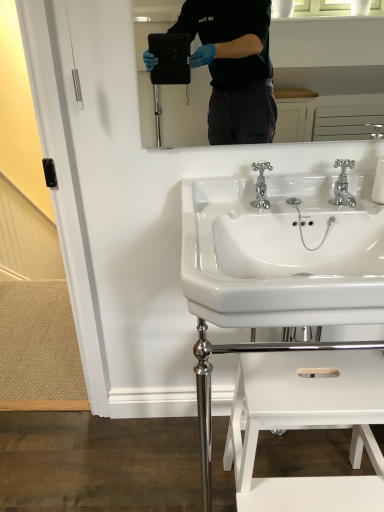
Question: From a real-world perspective, is white glossy step stool at lower center physically below white glossy sink at center, acting as the 2th sink starting from the bottom?

Choices:
 (A) yes
 (B) no

Answer: (A)

Question: Is white glossy step stool at lower center facing away from white glossy sink at center, acting as the 2th sink starting from the bottom?

Choices:
 (A) yes
 (B) no

Answer: (B)

Question: Is white glossy step stool at lower center taller than white glossy sink at center, arranged as the 1th sink when viewed from the top?

Choices:
 (A) yes
 (B) no

Answer: (A)

Question: Considering the relative sizes of white glossy step stool at lower center and white glossy sink at center, acting as the 2th sink starting from the bottom, in the image provided, is white glossy step stool at lower center shorter than white glossy sink at center, acting as the 2th sink starting from the bottom,?

Choices:
 (A) no
 (B) yes

Answer: (A)

Question: From the image's perspective, is white glossy step stool at lower center located beneath white glossy sink at center, acting as the 2th sink starting from the bottom?

Choices:
 (A) yes
 (B) no

Answer: (A)

Question: Does point (246, 272) appear closer or farther from the camera than point (215, 280)?

Choices:
 (A) closer
 (B) farther

Answer: (B)

Question: From the image's perspective, is white glossy sink at center, the first sink when ordered from bottom to top, positioned above or below white glossy sink at center, acting as the 2th sink starting from the bottom?

Choices:
 (A) below
 (B) above

Answer: (A)

Question: In the image, is white glossy sink at center, arranged as the 2th sink when viewed from the top, on the left side or the right side of white glossy sink at center, arranged as the 1th sink when viewed from the top?

Choices:
 (A) left
 (B) right

Answer: (B)

Question: In terms of height, does white glossy sink at center, arranged as the 2th sink when viewed from the top, look taller or shorter compared to white glossy sink at center, acting as the 2th sink starting from the bottom?

Choices:
 (A) short
 (B) tall

Answer: (B)

Question: Would you say chrome metallic faucet at center, which is the 1th tap from left to right, is inside or outside white glossy sink at center, arranged as the 2th sink when viewed from the top?

Choices:
 (A) inside
 (B) outside

Answer: (B)

Question: Looking at the image, does chrome metallic faucet at center, which is the 1th tap from left to right, seem bigger or smaller compared to white glossy sink at center, the first sink when ordered from bottom to top?

Choices:
 (A) big
 (B) small

Answer: (B)

Question: Considering the positions of point (254, 168) and point (233, 250), is point (254, 168) closer or farther from the camera than point (233, 250)?

Choices:
 (A) closer
 (B) farther

Answer: (B)

Question: In terms of height, does chrome metallic faucet at center, the second tap when ordered from right to left, look taller or shorter compared to white glossy sink at center, the first sink when ordered from bottom to top?

Choices:
 (A) short
 (B) tall

Answer: (A)

Question: Considering the positions of white glossy sink at center, arranged as the 1th sink when viewed from the top, and white glossy step stool at lower center in the image, is white glossy sink at center, arranged as the 1th sink when viewed from the top, wider or thinner than white glossy step stool at lower center?

Choices:
 (A) thin
 (B) wide

Answer: (B)

Question: Relative to white glossy step stool at lower center, is white glossy sink at center, arranged as the 1th sink when viewed from the top, in front or behind?

Choices:
 (A) front
 (B) behind

Answer: (A)